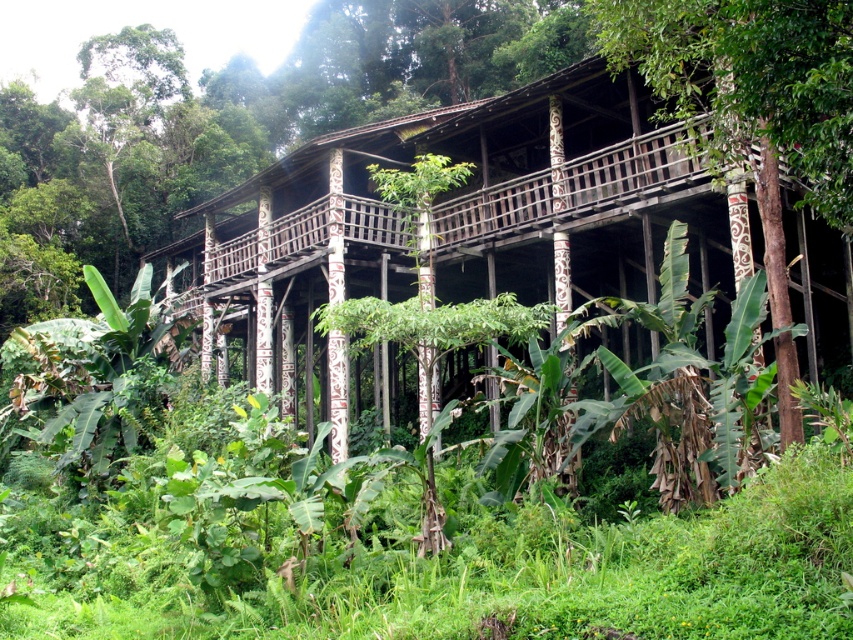
You are standing in front of the wooden hut at center and the brown wood pole at center. Which object is taller?

The wooden hut at center is much taller than the brown wood pole at center.

You are standing in front of the wooden hut at center and the brown wood pole at center. Which object is closer to you?

The wooden hut at center is closer to you because it is further to the viewer than the brown wood pole at center.